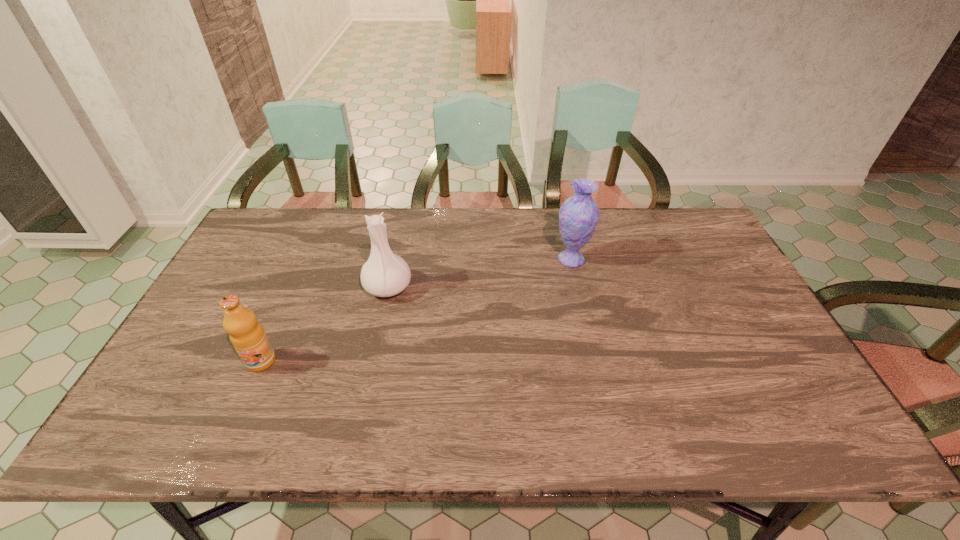
Identify the location of the rightmost object. The height and width of the screenshot is (540, 960). (579, 214).

Image resolution: width=960 pixels, height=540 pixels. I want to click on the left vase, so click(385, 274).

Where is `the leftmost object`? Image resolution: width=960 pixels, height=540 pixels. the leftmost object is located at coordinates (246, 334).

This screenshot has height=540, width=960. I want to click on fruit juice, so click(246, 334).

The height and width of the screenshot is (540, 960). Identify the location of vacant region located 0.100m on the right of the rightmost object. (621, 259).

Locate an element on the screen. vacant space situated on the front of the left vase is located at coordinates (355, 437).

Locate an element on the screen. free region located 0.160m on the front label of the fruit juice is located at coordinates (228, 434).

Identify the location of object present at the far edge. (579, 214).

This screenshot has height=540, width=960. In the image, there is a desktop. Identify the location of vacant region at the far edge. (412, 221).

In the image, there is a desktop. At what (x,y) coordinates should I click in order to perform the action: click on vacant space at the near edge. Please return your answer as a coordinate pair (x, y). The width and height of the screenshot is (960, 540). Looking at the image, I should click on (748, 411).